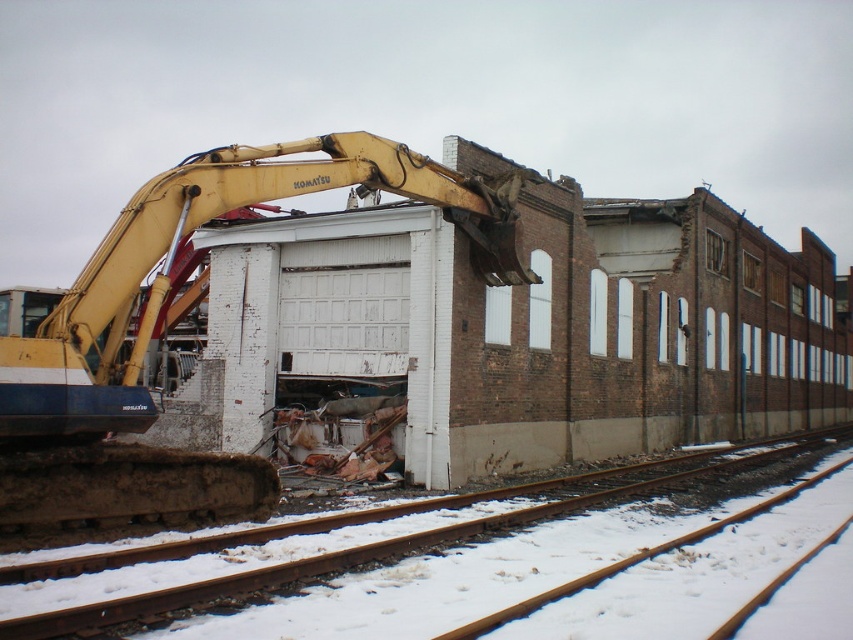
Question: Which object appears farthest from the camera in this image?

Choices:
 (A) yellow metallic excavator at center
 (B) snow-covered metal tracks at lower left

Answer: (A)

Question: Does snow-covered metal tracks at lower left appear over yellow metallic excavator at center?

Choices:
 (A) yes
 (B) no

Answer: (B)

Question: Does snow-covered metal tracks at lower left have a smaller size compared to yellow metallic excavator at center?

Choices:
 (A) no
 (B) yes

Answer: (B)

Question: Can you confirm if snow-covered metal tracks at lower left is positioned to the left of yellow metallic excavator at center?

Choices:
 (A) no
 (B) yes

Answer: (A)